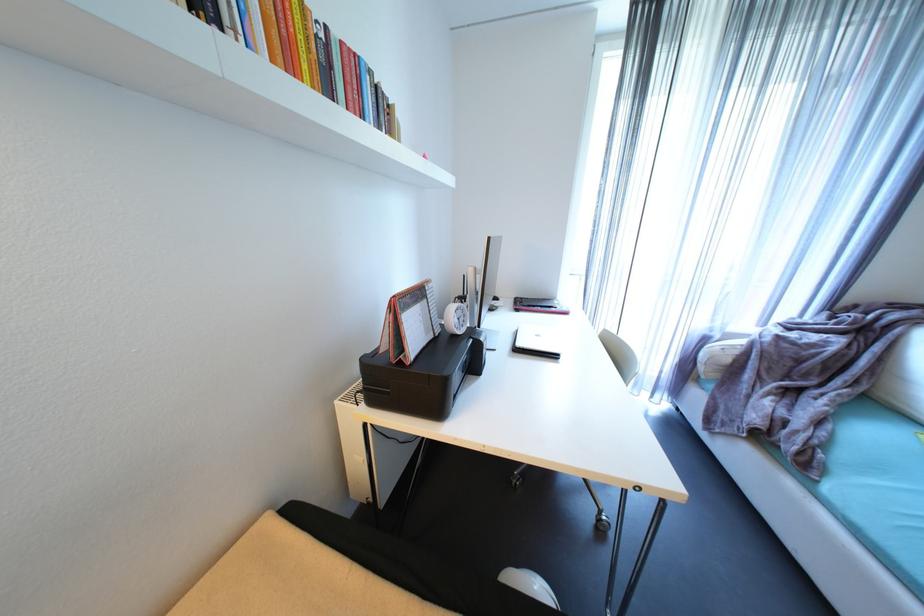
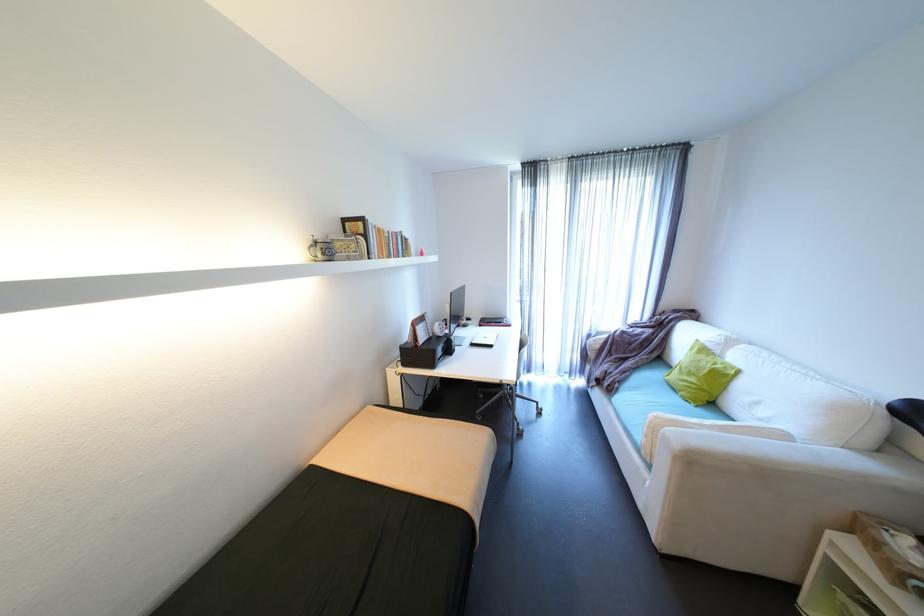
Find the pixel in the second image that matches pixel 238 34 in the first image.

(380, 254)